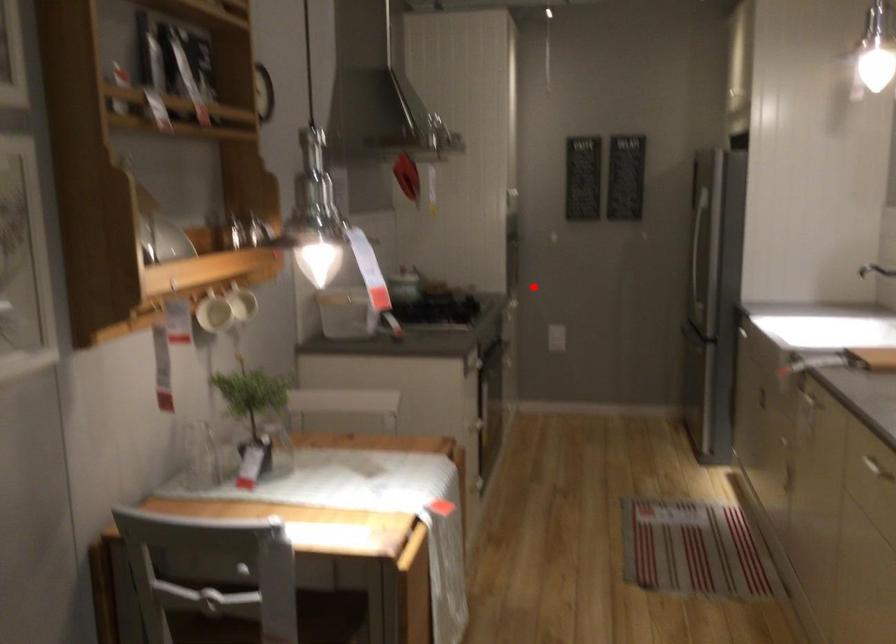
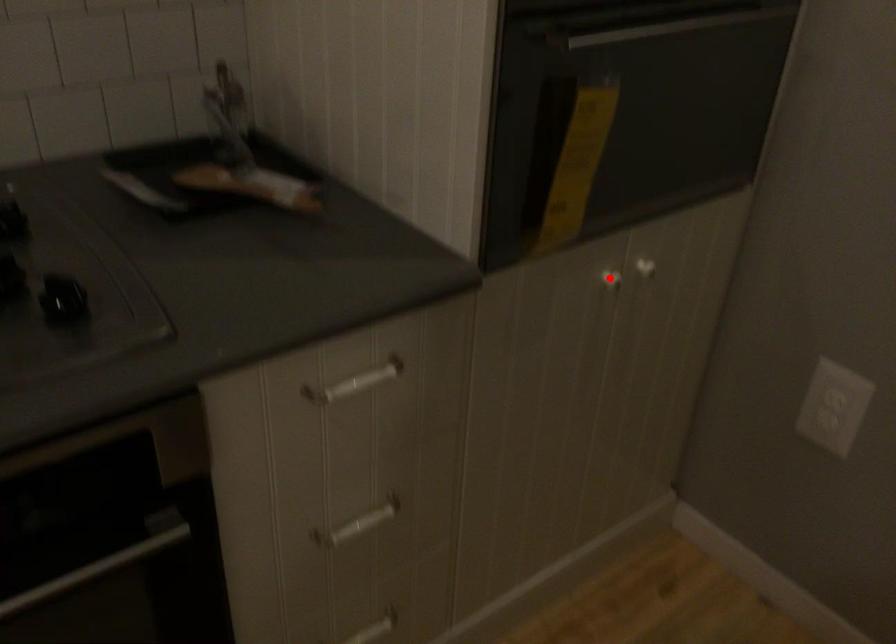
I am providing you with two images of the same scene from different viewpoints. A red point is marked on the first image and another point is marked on the second image. Is the red point in image1 aligned with the point shown in image2?

No